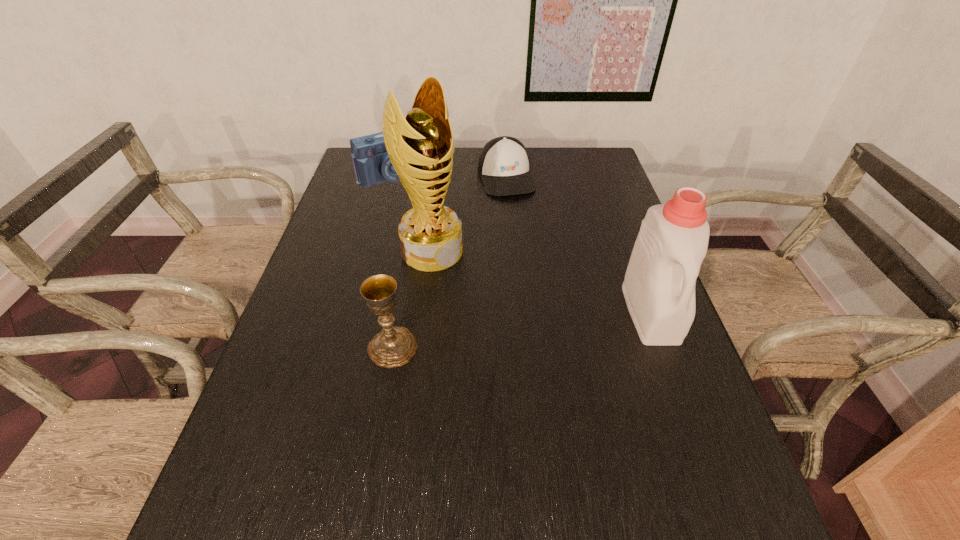
You are a GUI agent. You are given a task and a screenshot of the screen. Output one action in this format:
    pyautogui.click(x=<x>, y=<y>)
    Task: Click on the free space between the rightmost object and the chalice
    This screenshot has height=540, width=960.
    Given the screenshot: What is the action you would take?
    pyautogui.click(x=521, y=329)

At what (x,y) coordinates should I click in order to perform the action: click on vacant space that is in between the detergent and the fourth tallest object. Please return your answer as a coordinate pair (x, y). The height and width of the screenshot is (540, 960). Looking at the image, I should click on (522, 244).

What are the coordinates of `blank region between the fourth tallest object and the third tallest object` in the screenshot? It's located at (394, 261).

Locate an element on the screen. The height and width of the screenshot is (540, 960). free spot between the third nearest object and the cap is located at coordinates (469, 214).

The height and width of the screenshot is (540, 960). I want to click on free space between the award and the rightmost object, so click(x=541, y=281).

This screenshot has height=540, width=960. Identify the location of the second closest object to the shortest object. (419, 147).

I want to click on the second closest object to the camera, so click(x=419, y=147).

Where is `free region that satisfies the following two spatial constraints: 1. on the front side of the camera; 2. on the left side of the shortest object`? free region that satisfies the following two spatial constraints: 1. on the front side of the camera; 2. on the left side of the shortest object is located at coordinates (394, 178).

Where is `vacant space that satisfies the following two spatial constraints: 1. on the back side of the shortest object; 2. on the right side of the third shortest object`? The image size is (960, 540). vacant space that satisfies the following two spatial constraints: 1. on the back side of the shortest object; 2. on the right side of the third shortest object is located at coordinates (422, 178).